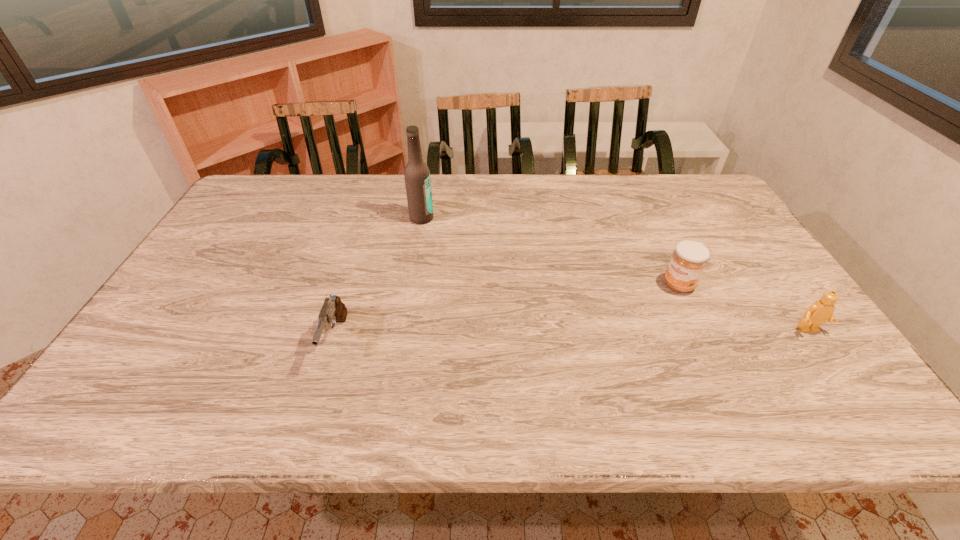
Locate an element on the screen. free space at the far left corner is located at coordinates (292, 176).

Identify the location of free space at the far right corner of the desktop. (683, 205).

I want to click on free space that is in between the pistol and the farthest object, so (x=378, y=279).

This screenshot has height=540, width=960. Identify the location of vacant region between the beer bottle and the rightmost object. (615, 274).

Find the location of a particular element. This screenshot has width=960, height=540. vacant area between the second farthest object and the pistol is located at coordinates tap(507, 312).

Identify the location of blank region between the pistol and the farthest object. tap(378, 279).

This screenshot has height=540, width=960. I want to click on unoccupied area between the rightmost object and the third object from left to right, so click(x=744, y=307).

What are the coordinates of `vacant space in between the leftmost object and the rightmost object` in the screenshot? It's located at (572, 335).

The height and width of the screenshot is (540, 960). What are the coordinates of `free space between the pistol and the farthest object` in the screenshot? It's located at (378, 279).

Where is `free point between the Lego and the leftmost object`? Image resolution: width=960 pixels, height=540 pixels. free point between the Lego and the leftmost object is located at coordinates (572, 335).